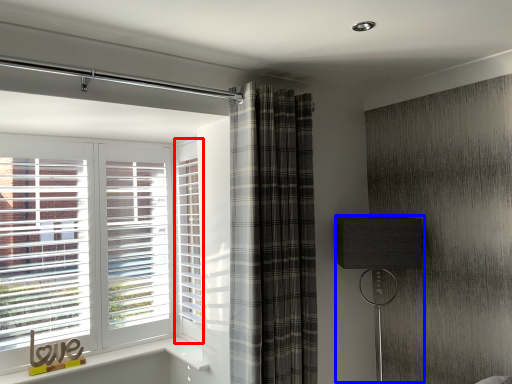
Question: Which object is closer to the camera taking this photo, screen door (highlighted by a red box) or table lamp (highlighted by a blue box)?

Choices:
 (A) screen door
 (B) table lamp

Answer: (B)